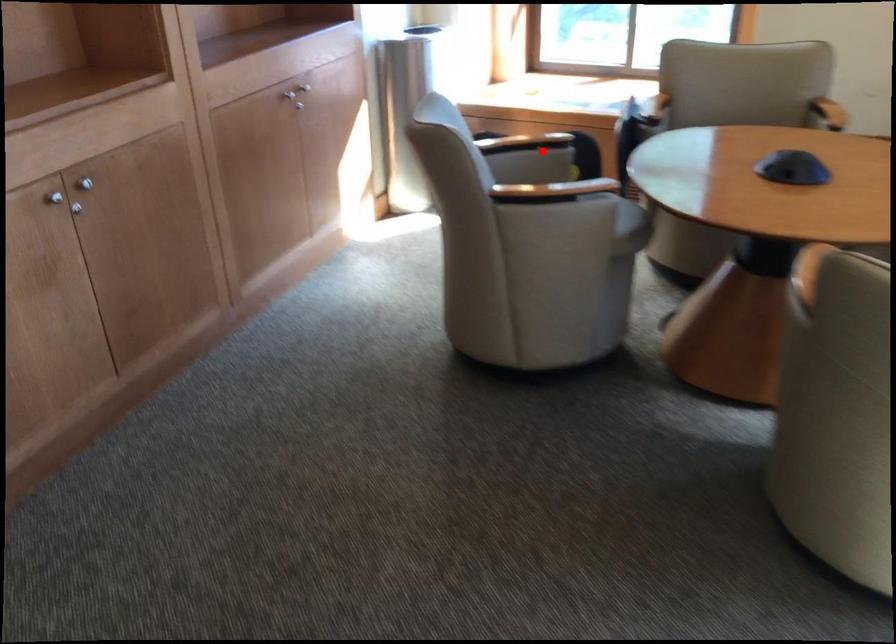
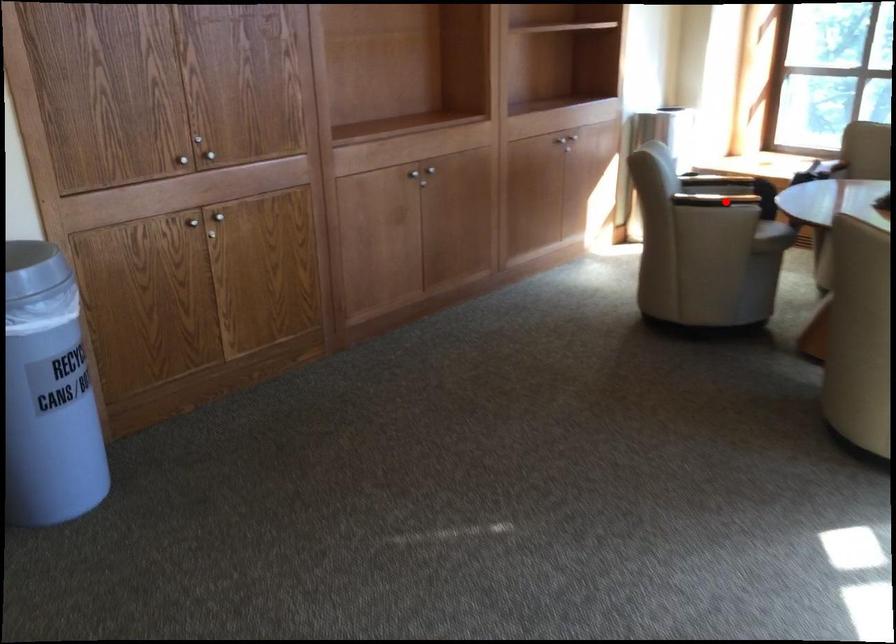
I am providing you with two images of the same scene from different viewpoints. A red point is marked on the first image and another point is marked on the second image. Does the point marked in image1 correspond to the same location as the one in image2?

No